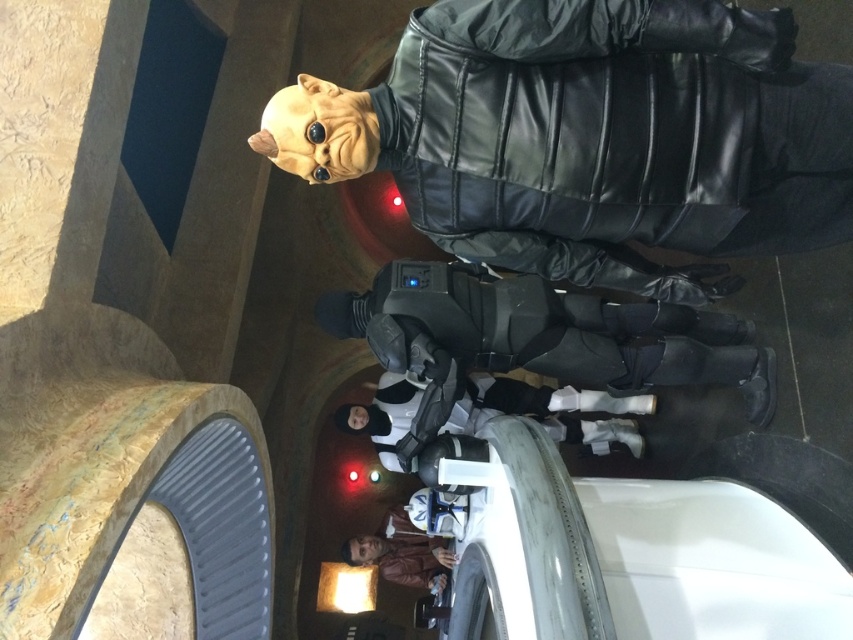
Is matte black armor at center closer to camera compared to white matte robot at center?

Yes.

This screenshot has height=640, width=853. Find the location of `matte black armor at center`. matte black armor at center is located at coordinates (548, 332).

Is matte black armor at center smaller than brown leather jacket at lower center?

Actually, matte black armor at center might be larger than brown leather jacket at lower center.

Based on the photo, can you confirm if matte black armor at center is positioned below brown leather jacket at lower center?

Incorrect, matte black armor at center is not positioned below brown leather jacket at lower center.

Between point (670, 332) and point (375, 544), which one is positioned behind?

Point (375, 544)

I want to click on matte black armor at center, so click(x=548, y=332).

Measure the distance between point (461, 428) and camera.

Point (461, 428) and camera are 3.90 meters apart from each other.

Does white matte robot at center have a smaller size compared to brown leather jacket at lower center?

Incorrect, white matte robot at center is not smaller in size than brown leather jacket at lower center.

Find the location of a particular element. white matte robot at center is located at coordinates (549, 412).

This screenshot has height=640, width=853. I want to click on white matte robot at center, so click(549, 412).